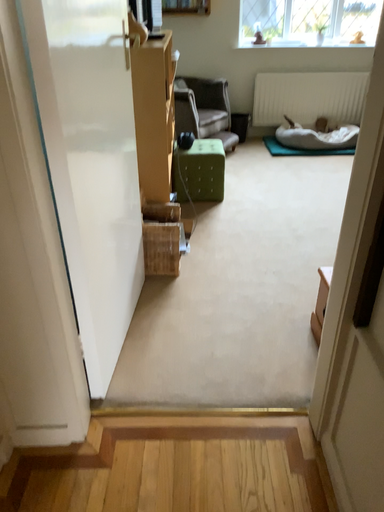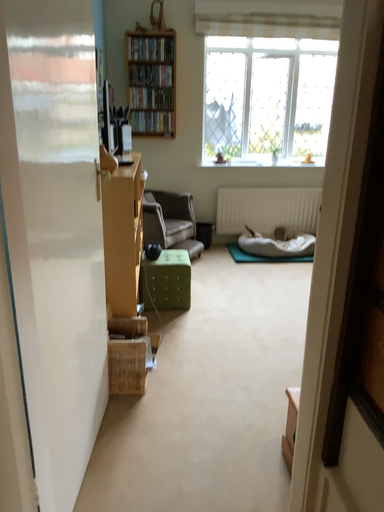
Question: Which way did the camera rotate in the video?

Choices:
 (A) rotated downward
 (B) rotated upward

Answer: (B)